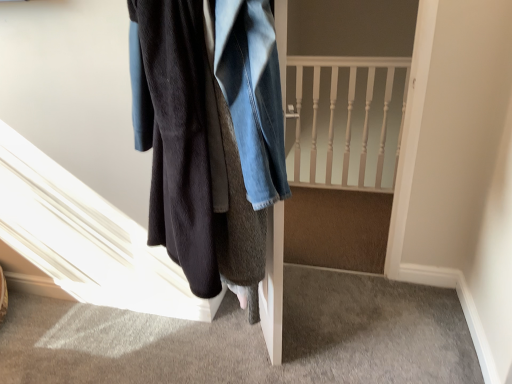
Image resolution: width=512 pixels, height=384 pixels. In order to click on velvety dark brown coat at center in this screenshot , I will do `click(204, 123)`.

This screenshot has height=384, width=512. Describe the element at coordinates (204, 123) in the screenshot. I see `velvety dark brown coat at center` at that location.

What is the approximate width of velvety dark brown coat at center?

It is 10.55 inches.

You are a GUI agent. You are given a task and a screenshot of the screen. Output one action in this format:
    pyautogui.click(x=<x>, y=<y>)
    Task: Click on the velvety dark brown coat at center
    This screenshot has width=512, height=384.
    Given the screenshot: What is the action you would take?
    pyautogui.click(x=204, y=123)